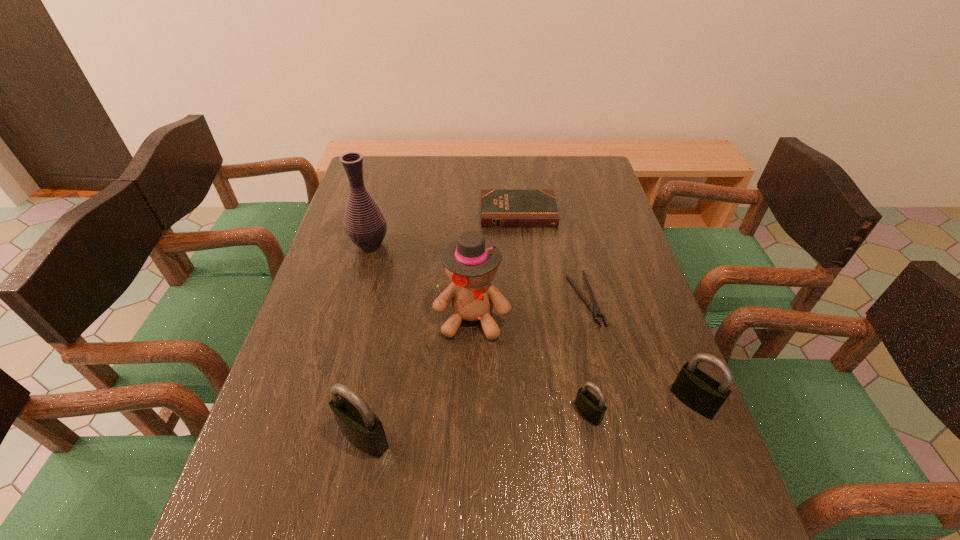
Locate an element on the screen. The width and height of the screenshot is (960, 540). vacant region at the near right corner is located at coordinates (645, 470).

This screenshot has height=540, width=960. In order to click on free space between the shortest object and the second padlock from right to left in this screenshot , I will do `click(587, 356)`.

Locate an element on the screen. The height and width of the screenshot is (540, 960). vacant space that's between the second tallest object and the rightmost padlock is located at coordinates (583, 360).

Locate an element on the screen. Image resolution: width=960 pixels, height=540 pixels. free point between the rag_doll and the shortest object is located at coordinates (529, 309).

Identify the location of vacant area between the rag_doll and the shortest padlock. (530, 365).

You are a GUI agent. You are given a task and a screenshot of the screen. Output one action in this format:
    pyautogui.click(x=<x>, y=<y>)
    Task: Click on the empty location between the second shortest object and the shortest padlock
    This screenshot has height=540, width=960.
    Given the screenshot: What is the action you would take?
    pyautogui.click(x=553, y=313)

Find the location of `vacant space in between the farthest object and the vase`. vacant space in between the farthest object and the vase is located at coordinates (444, 229).

At what (x,y) coordinates should I click in order to perform the action: click on unoccupied position between the rightmost padlock and the leftmost padlock. Please return your answer as a coordinate pair (x, y). This screenshot has width=960, height=540. Looking at the image, I should click on (528, 420).

Find the location of a particular element. The image size is (960, 540). free space between the rag_doll and the sixth nearest object is located at coordinates (421, 281).

This screenshot has width=960, height=540. I want to click on empty space between the fourth shortest object and the sixth nearest object, so click(x=532, y=323).